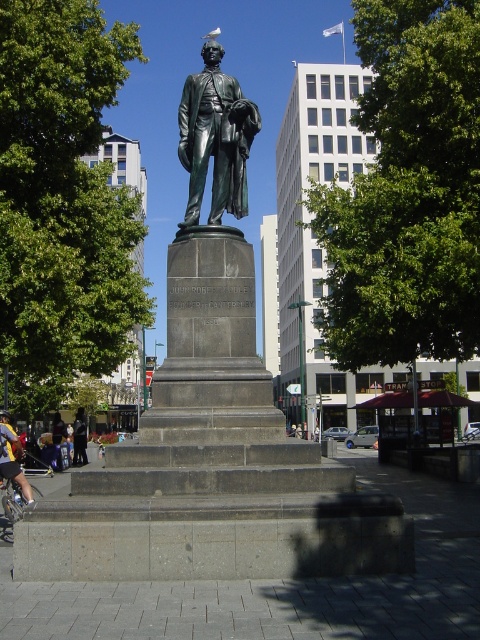
Does green-bronze statue at center appear on the right side of yellow fabric at lower left?

Indeed, green-bronze statue at center is positioned on the right side of yellow fabric at lower left.

Who is more distant from viewer, (226, 120) or (13, 480)?

Point (13, 480)

Identify the location of green-bronze statue at center. This screenshot has width=480, height=640. (216, 138).

I want to click on yellow fabric at lower left, so click(x=12, y=460).

Consider the image. Who is more forward, (24, 499) or (79, 445)?

Positioned in front is point (24, 499).

Find the location of a particular element. yellow fabric at lower left is located at coordinates (12, 460).

Which is below, green-bronze statue at center or dark gray suit at center?

dark gray suit at center is lower down.

What do you see at coordinates (216, 138) in the screenshot? This screenshot has height=640, width=480. I see `green-bronze statue at center` at bounding box center [216, 138].

This screenshot has width=480, height=640. In order to click on green-bronze statue at center in this screenshot , I will do `click(216, 138)`.